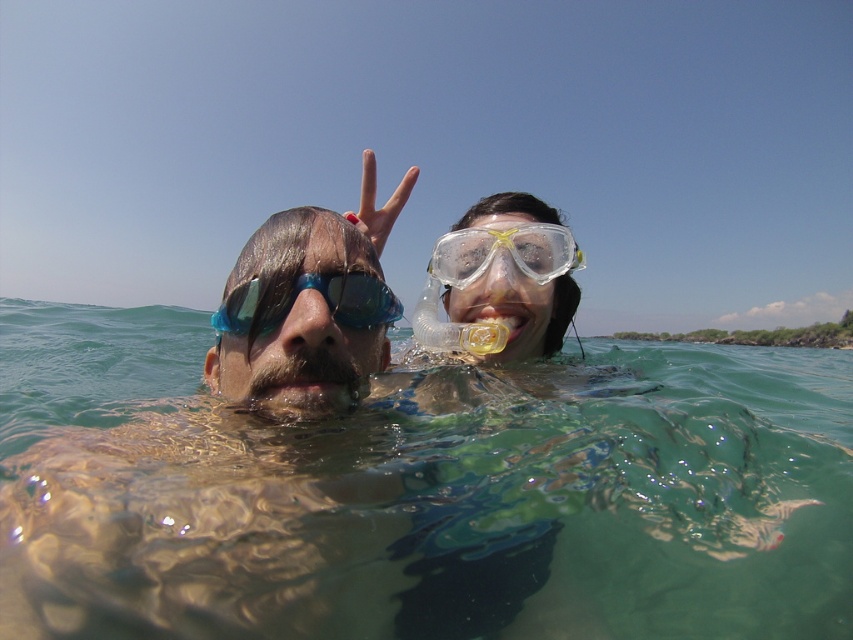
You are a snorkeler preparing to dive into the water. You see the clear water at center and the clear plastic goggles at upper right. Which one would you reach first when entering the water?

The clear water at center is in front of the clear plastic goggles at upper right, so you would reach the clear water at center first when entering the water.

You are a photographer taking a picture of the blue reflective goggles at center and the clear plastic goggles at upper right. Which pair of goggles will appear larger in the photo?

The blue reflective goggles at center will appear larger in the photo because they are closer to the viewer than the clear plastic goggles at upper right.

You are a swimmer who wants to choose between the blue reflective goggles at center and the clear plastic goggles at upper right. Which pair has a smaller width?

The blue reflective goggles at center has a lesser width compared to clear plastic goggles at upper right, so the blue reflective goggles at center is the smaller one.